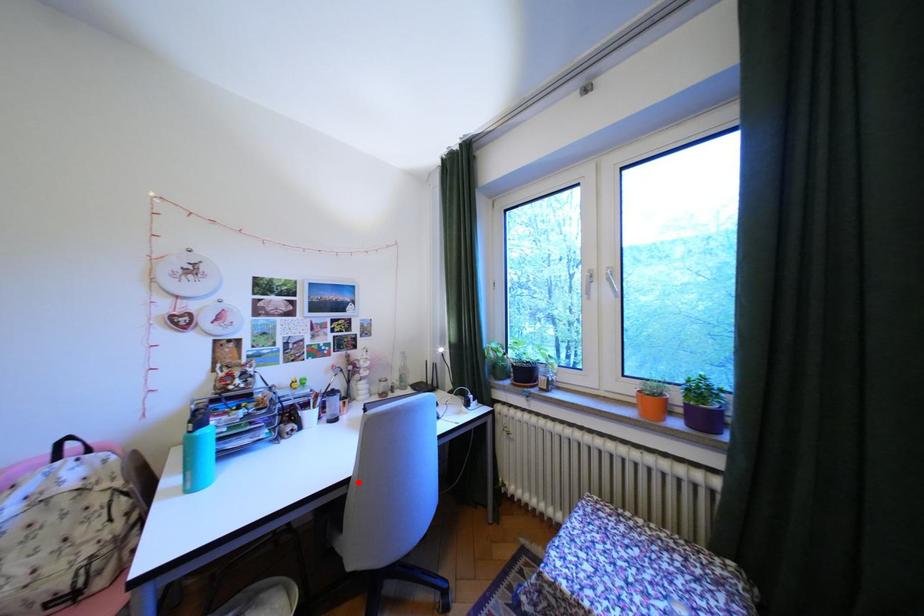
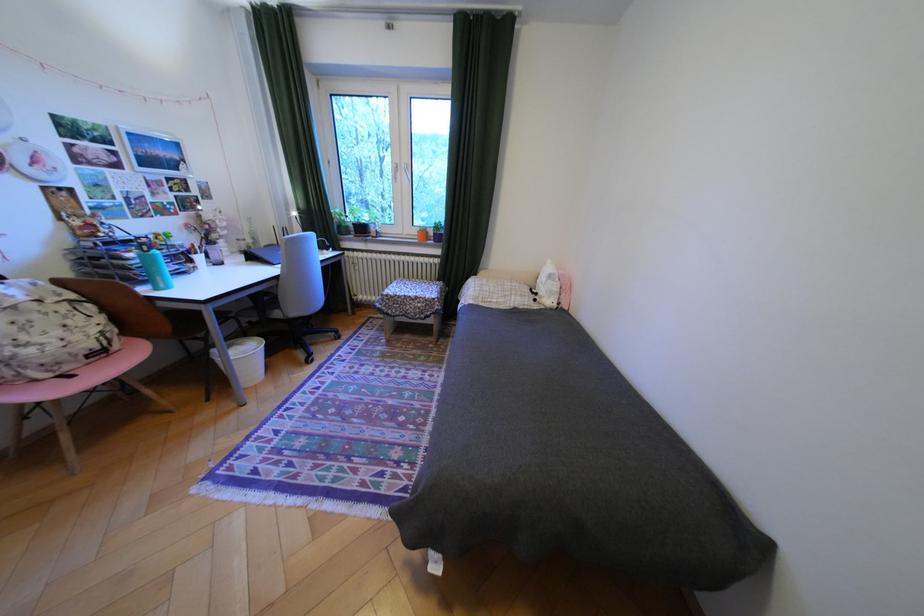
Question: I am providing you with two images of the same scene from different viewpoints. A red point is marked on the first image. At the location where the point appears in image 1, is it still visible in image 2?

Choices:
 (A) Yes
 (B) No

Answer: (A)